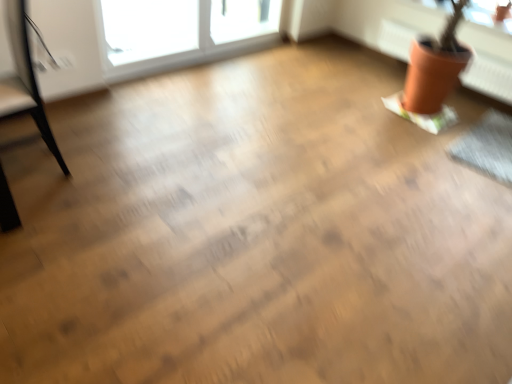
Question: From the image's perspective, does transparent glass window screen at upper right appear higher than black leather armchair at left?

Choices:
 (A) no
 (B) yes

Answer: (B)

Question: Would you say transparent glass window screen at upper right is outside black leather armchair at left?

Choices:
 (A) yes
 (B) no

Answer: (A)

Question: Is transparent glass window screen at upper right positioned before black leather armchair at left?

Choices:
 (A) yes
 (B) no

Answer: (B)

Question: Is transparent glass window screen at upper right smaller than black leather armchair at left?

Choices:
 (A) yes
 (B) no

Answer: (A)

Question: Is there a large distance between transparent glass window screen at upper right and black leather armchair at left?

Choices:
 (A) yes
 (B) no

Answer: (A)

Question: Does transparent glass window screen at upper right come behind black leather armchair at left?

Choices:
 (A) no
 (B) yes

Answer: (B)

Question: From a real-world perspective, is black leather armchair at left below transparent glass window screen at upper right?

Choices:
 (A) yes
 (B) no

Answer: (A)

Question: Could you tell me if black leather armchair at left is facing transparent glass window screen at upper right?

Choices:
 (A) yes
 (B) no

Answer: (B)

Question: Does black leather armchair at left have a greater width compared to transparent glass window screen at upper right?

Choices:
 (A) no
 (B) yes

Answer: (B)

Question: From the image's perspective, would you say black leather armchair at left is shown under transparent glass window screen at upper right?

Choices:
 (A) no
 (B) yes

Answer: (B)

Question: Considering the relative sizes of black leather armchair at left and transparent glass window screen at upper right in the image provided, is black leather armchair at left smaller than transparent glass window screen at upper right?

Choices:
 (A) no
 (B) yes

Answer: (A)

Question: Can we say black leather armchair at left lies outside transparent glass window screen at upper right?

Choices:
 (A) no
 (B) yes

Answer: (B)

Question: Is black leather armchair at left to the left of terracotta clay pot at upper right from the viewer's perspective?

Choices:
 (A) yes
 (B) no

Answer: (A)